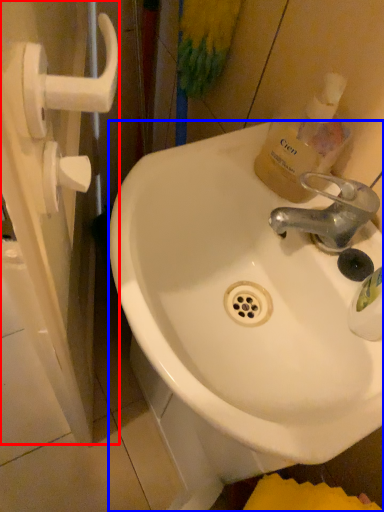
Question: Which object appears closest to the camera in this image, screen door (highlighted by a red box) or sink (highlighted by a blue box)?

Choices:
 (A) screen door
 (B) sink

Answer: (A)